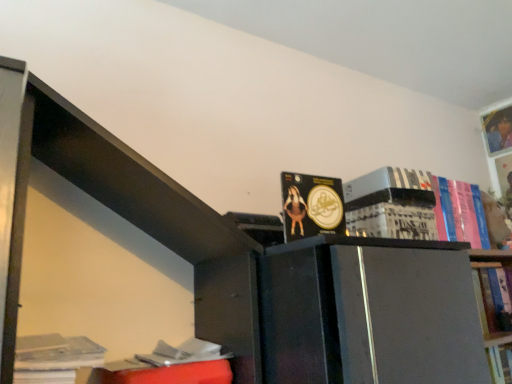
Describe the element at coordinates (498, 129) in the screenshot. This screenshot has height=384, width=512. I see `hardcover book at upper right, the 5th book in the left-to-right sequence` at that location.

The height and width of the screenshot is (384, 512). What do you see at coordinates (462, 212) in the screenshot?
I see `hardcover book at upper right, arranged as the 4th book when viewed from the front` at bounding box center [462, 212].

At what (x,y) coordinates should I click in order to perform the action: click on white paper at center, the first paperback book ordered from the bottom. Please return your answer as a coordinate pair (x, y). Looking at the image, I should click on (392, 222).

What do you see at coordinates (54, 358) in the screenshot? I see `white paper stack at lower left, the fifth book when ordered from right to left` at bounding box center [54, 358].

What is the approximate width of hardcover book at upper right, which appears as the third book when viewed from the right?

hardcover book at upper right, which appears as the third book when viewed from the right, is 5.33 inches in width.

The image size is (512, 384). What are the coordinates of `black matte book at upper right, the 2th paperback book when ordered from bottom to top` in the screenshot? It's located at (387, 186).

Is hardcover book at upper right, which appears as the third book when viewed from the right, facing towards hardcover book at upper right, the first book viewed from the right?

No.

Is the surface of hardcover book at upper right, which appears as the third book when viewed from the right, in direct contact with hardcover book at upper right, the 5th book in the left-to-right sequence?

hardcover book at upper right, which appears as the third book when viewed from the right, is not next to hardcover book at upper right, the 5th book in the left-to-right sequence, and they're not touching.

Choose the correct answer: Is hardcover book at upper right, which appears as the third book when viewed from the right, inside hardcover book at upper right, the 1th book viewed from the back, or outside it?

hardcover book at upper right, which appears as the third book when viewed from the right, is spatially situated outside hardcover book at upper right, the 1th book viewed from the back.

Between hardcover book at upper right, arranged as the 3th book when viewed from the front, and hardcover book at upper right, the first book viewed from the right, which one has less height?

hardcover book at upper right, arranged as the 3th book when viewed from the front.

In the scene shown: Can you confirm if black matte book at upper right, the first paperback book in the top-to-bottom sequence, is bigger than hardcover book at upper right, marked as the 2th book in a back-to-front arrangement?

No.

Is black matte book at upper right, the first paperback book in the top-to-bottom sequence, at the left side of hardcover book at upper right, marked as the 2th book in a back-to-front arrangement?

Correct, you'll find black matte book at upper right, the first paperback book in the top-to-bottom sequence, to the left of hardcover book at upper right, marked as the 2th book in a back-to-front arrangement.

From the picture: Considering the sizes of objects black matte book at upper right, the 2th paperback book when ordered from bottom to top, and hardcover book at upper right, arranged as the 4th book when viewed from the left, in the image provided, who is thinner, black matte book at upper right, the 2th paperback book when ordered from bottom to top, or hardcover book at upper right, arranged as the 4th book when viewed from the left,?

Thinner between the two is hardcover book at upper right, arranged as the 4th book when viewed from the left.

Can you confirm if black matte book at upper right, the first paperback book in the top-to-bottom sequence, is taller than hardcover book at upper right, marked as the 2th book in a back-to-front arrangement?

No.

Could you tell me if hardcover book at upper right, which appears as the third book when viewed from the right, is facing matte gold coin at center, the fourth book positioned from the back?

No, hardcover book at upper right, which appears as the third book when viewed from the right, is not facing towards matte gold coin at center, the fourth book positioned from the back.

Is hardcover book at upper right, which appears as the third book when viewed from the right, shorter than matte gold coin at center, the 4th book when ordered from right to left?

Incorrect, the height of hardcover book at upper right, which appears as the third book when viewed from the right, does not fall short of that of matte gold coin at center, the 4th book when ordered from right to left.

Is hardcover book at upper right, arranged as the 3th book when viewed from the front, far away from matte gold coin at center, the 4th book when ordered from right to left?

That's not correct — hardcover book at upper right, arranged as the 3th book when viewed from the front, is a little close to matte gold coin at center, the 4th book when ordered from right to left.

Which object is further away from the camera, hardcover book at upper right, arranged as the 3th book when viewed from the front, or matte gold coin at center, the 2th book positioned from the front?

hardcover book at upper right, arranged as the 3th book when viewed from the front, is behind.

The image size is (512, 384). In order to click on the 2nd book in front of the black matte book at upper right, the 2th paperback book when ordered from bottom to top in this screenshot , I will do coord(54,358).

Is black matte book at upper right, the first paperback book in the top-to-bottom sequence, taller than white paper stack at lower left, which appears as the first book when viewed from the left?

Incorrect, the height of black matte book at upper right, the first paperback book in the top-to-bottom sequence, is not larger of that of white paper stack at lower left, which appears as the first book when viewed from the left.

Does black matte book at upper right, the 2th paperback book when ordered from bottom to top, touch white paper stack at lower left, which ranks as the fifth book in back-to-front order?

black matte book at upper right, the 2th paperback book when ordered from bottom to top, and white paper stack at lower left, which ranks as the fifth book in back-to-front order, are not in contact.

From a real-world perspective, is black matte book at upper right, the first paperback book in the top-to-bottom sequence, on top of white paper stack at lower left, which ranks as the fifth book in back-to-front order?

Yes, from a real-world perspective, black matte book at upper right, the first paperback book in the top-to-bottom sequence, is over white paper stack at lower left, which ranks as the fifth book in back-to-front order

Between matte gold coin at center, the 2th book positioned from the front, and white paper stack at lower left, which appears as the first book when viewed from the left, which one appears on the left side from the viewer's perspective?

Positioned to the left is white paper stack at lower left, which appears as the first book when viewed from the left.

Which is farther from the camera, (x=309, y=207) or (x=71, y=370)?

The point (x=309, y=207) is farther from the camera.

In the image, is matte gold coin at center, the 2th book positioned from the front, positioned in front of or behind white paper stack at lower left, which appears as the first book when viewed from the left?

Visually, matte gold coin at center, the 2th book positioned from the front, is located behind white paper stack at lower left, which appears as the first book when viewed from the left.

From the image's perspective, is matte gold coin at center, the 2th book positioned from the front, on white paper stack at lower left, which appears as the first book when viewed from the left?

Yes.

Find the location of a particular element. The image size is (512, 384). book that is the 1st one when counting rightward from the black matte book at upper right, the first paperback book in the top-to-bottom sequence is located at coordinates (393, 204).

Which is farther from the camera, (369, 190) or (404, 201)?

Point (369, 190)

Is black matte book at upper right, the 2th paperback book when ordered from bottom to top, far from hardcover book at upper right, positioned as the 3th book in left-to-right order?

No, black matte book at upper right, the 2th paperback book when ordered from bottom to top, is not far away from hardcover book at upper right, positioned as the 3th book in left-to-right order.

From the image's perspective, would you say black matte book at upper right, the first paperback book in the top-to-bottom sequence, is shown under hardcover book at upper right, arranged as the 3th book when viewed from the front?

No, from the image's perspective, black matte book at upper right, the first paperback book in the top-to-bottom sequence, is not below hardcover book at upper right, arranged as the 3th book when viewed from the front.

Between hardcover book at upper right, marked as the fifth book in a front-to-back arrangement, and matte gold coin at center, the fourth book positioned from the back, which one is positioned in front?

→ matte gold coin at center, the fourth book positioned from the back, is closer to the camera.

Choose the correct answer: Is hardcover book at upper right, the 5th book in the left-to-right sequence, inside matte gold coin at center, the 2th book from the left, or outside it?

hardcover book at upper right, the 5th book in the left-to-right sequence, exists outside the volume of matte gold coin at center, the 2th book from the left.

From a real-world perspective, between hardcover book at upper right, the 5th book in the left-to-right sequence, and matte gold coin at center, the 2th book positioned from the front, who is vertically higher?

hardcover book at upper right, the 5th book in the left-to-right sequence, from a real-world perspective.

Are hardcover book at upper right, the first book viewed from the right, and matte gold coin at center, the 2th book positioned from the front, far apart?

Answer: Yes, hardcover book at upper right, the first book viewed from the right, and matte gold coin at center, the 2th book positioned from the front, are located far from each other.

From the image's perspective, count 2nd books upward from the hardcover book at upper right, marked as the third book in a back-to-front arrangement, and point to it. Please provide its 2D coordinates.

[(498, 129)]

Locate an element on the screen. Image resolution: width=512 pixels, height=384 pixels. the 1st paperback book counting from the left side of the hardcover book at upper right, marked as the 2th book in a back-to-front arrangement is located at coordinates (387, 186).

From the image, which object appears to be farther from matte gold coin at center, the fourth book positioned from the back, black matte book at upper right, the first paperback book in the top-to-bottom sequence, or white paper stack at lower left, which ranks as the fifth book in back-to-front order?

Among the two, white paper stack at lower left, which ranks as the fifth book in back-to-front order, is located further to matte gold coin at center, the fourth book positioned from the back.

Looking at this image, which object lies further to the anchor point hardcover book at upper right, the first book viewed from the right, black matte book at upper right, the 2th paperback book when ordered from bottom to top, or hardcover book at upper right, marked as the third book in a back-to-front arrangement?

black matte book at upper right, the 2th paperback book when ordered from bottom to top.

When comparing their distances from white paper stack at lower left, which ranks as the fifth book in back-to-front order, does hardcover book at upper right, the 1th book viewed from the back, or matte gold coin at center, the fourth book positioned from the back, seem further?

Among the two, hardcover book at upper right, the 1th book viewed from the back, is located further to white paper stack at lower left, which ranks as the fifth book in back-to-front order.

When comparing their distances from hardcover book at upper right, marked as the fifth book in a front-to-back arrangement, does hardcover book at upper right, which appears as the third book when viewed from the right, or white paper stack at lower left, which ranks as the fifth book in back-to-front order, seem further?

white paper stack at lower left, which ranks as the fifth book in back-to-front order, is further to hardcover book at upper right, marked as the fifth book in a front-to-back arrangement.

Which object lies further to the anchor point matte gold coin at center, the 2th book positioned from the front, hardcover book at upper right, positioned as the 3th book in left-to-right order, or white paper at center, the second paperback book positioned from the top?

hardcover book at upper right, positioned as the 3th book in left-to-right order, lies further to matte gold coin at center, the 2th book positioned from the front, than the other object.

Based on their spatial positions, is hardcover book at upper right, marked as the 2th book in a back-to-front arrangement, or matte gold coin at center, the 4th book when ordered from right to left, further from hardcover book at upper right, the first book viewed from the right?

matte gold coin at center, the 4th book when ordered from right to left.

When comparing their distances from hardcover book at upper right, the first book viewed from the right, does matte gold coin at center, the 4th book when ordered from right to left, or black matte book at upper right, the 2th paperback book when ordered from bottom to top, seem closer?

Based on the image, black matte book at upper right, the 2th paperback book when ordered from bottom to top, appears to be nearer to hardcover book at upper right, the first book viewed from the right.

From the image, which object appears to be farther from black matte book at upper right, the first paperback book in the top-to-bottom sequence, hardcover book at upper right, the 5th book in the left-to-right sequence, or hardcover book at upper right, arranged as the 3th book when viewed from the front?

hardcover book at upper right, the 5th book in the left-to-right sequence, lies further to black matte book at upper right, the first paperback book in the top-to-bottom sequence, than the other object.

Where is `paperback book between white paper at center, the second paperback book positioned from the top, and hardcover book at upper right, marked as the fifth book in a front-to-back arrangement, in the horizontal direction`? This screenshot has height=384, width=512. paperback book between white paper at center, the second paperback book positioned from the top, and hardcover book at upper right, marked as the fifth book in a front-to-back arrangement, in the horizontal direction is located at coordinates (387, 186).

Find the location of a particular element. The image size is (512, 384). book between white paper stack at lower left, which ranks as the fifth book in back-to-front order, and hardcover book at upper right, marked as the third book in a back-to-front arrangement, in the horizontal direction is located at coordinates (312, 205).

Where is `book positioned between hardcover book at upper right, positioned as the 3th book in left-to-right order, and hardcover book at upper right, the first book viewed from the right, from near to far`? The width and height of the screenshot is (512, 384). book positioned between hardcover book at upper right, positioned as the 3th book in left-to-right order, and hardcover book at upper right, the first book viewed from the right, from near to far is located at coordinates (462, 212).

The width and height of the screenshot is (512, 384). Find the location of `book between white paper stack at lower left, which appears as the 1th book when viewed from the front, and white paper at center, the first paperback book ordered from the bottom`. book between white paper stack at lower left, which appears as the 1th book when viewed from the front, and white paper at center, the first paperback book ordered from the bottom is located at coordinates (312, 205).